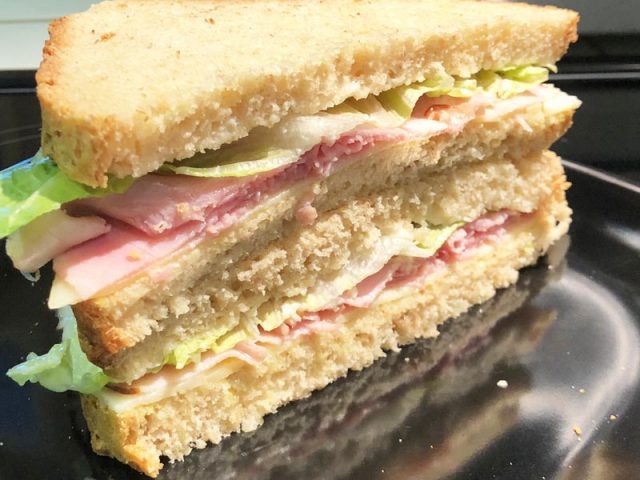
You are a GUI agent. You are given a task and a screenshot of the screen. Output one action in this format:
    pyautogui.click(x=<x>, y=<y>)
    Task: Click on the white wall
    The width and height of the screenshot is (640, 480).
    Given the screenshot: What is the action you would take?
    pos(9,34)